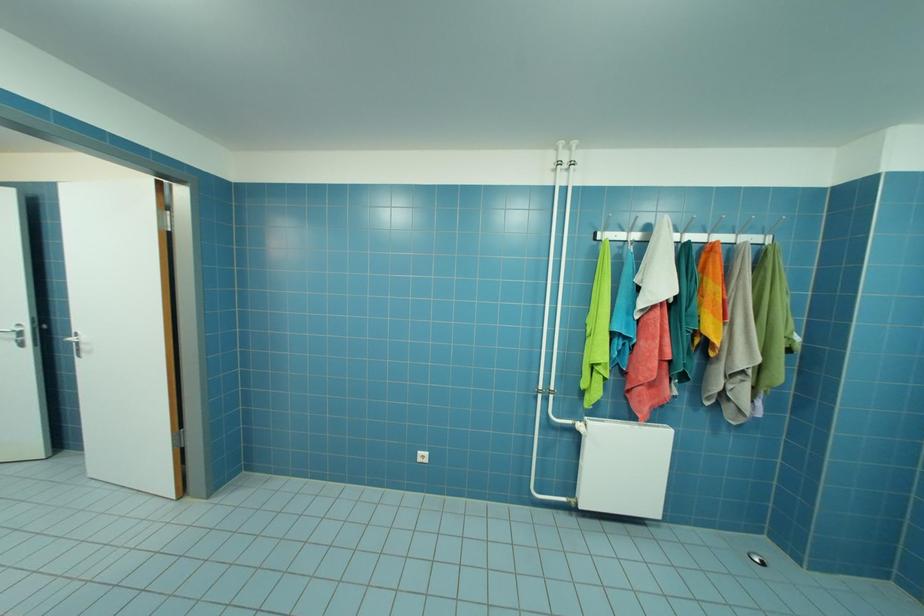
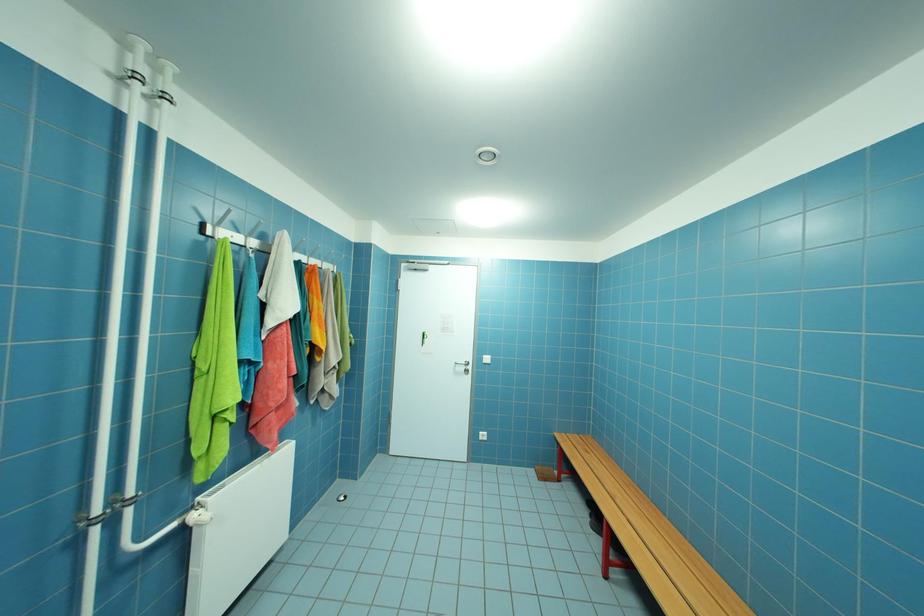
Question: How did the camera likely rotate?

Choices:
 (A) Left
 (B) Right
 (C) Up
 (D) Down

Answer: (B)